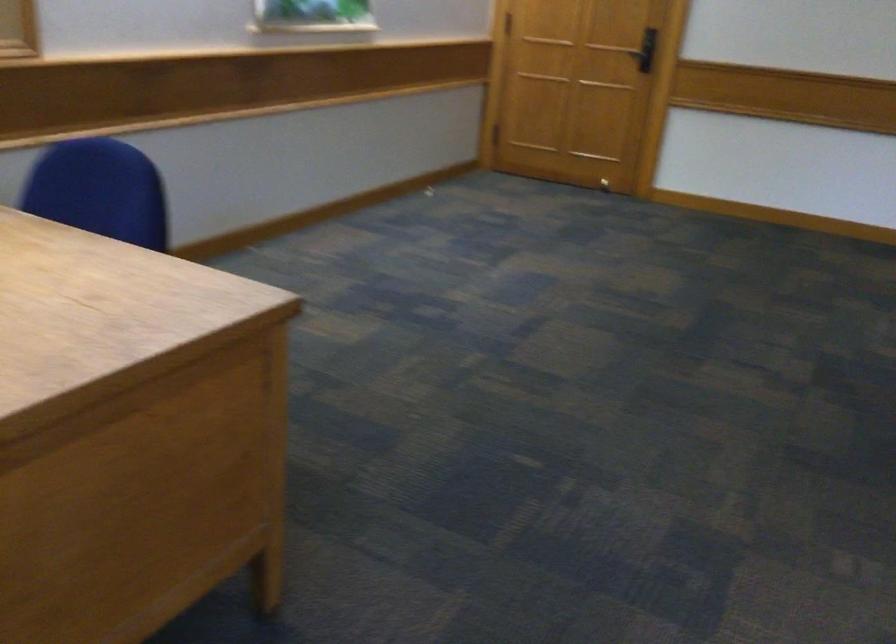
Where would you turn the black door handle? Please return your answer as a coordinate pair (x, y).

(581, 89)